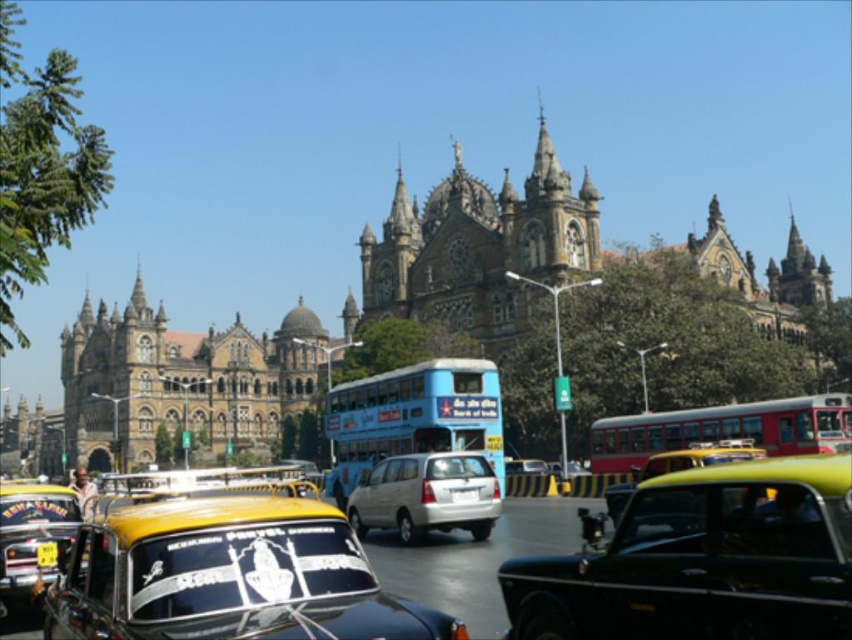
Question: Is yellow matte taxi cab at lower left below white plastic license plate at center?

Choices:
 (A) no
 (B) yes

Answer: (B)

Question: Which of the following is the closest to the observer?

Choices:
 (A) (186, 596)
 (B) (36, 586)

Answer: (A)

Question: Does yellow matte taxi cab at center have a larger size compared to white matte van at center?

Choices:
 (A) yes
 (B) no

Answer: (A)

Question: Estimate the real-world distances between objects in this image. Which object is closer to the yellow matte taxi cab at center?

Choices:
 (A) black glossy taxi at center
 (B) yellow matte taxi cab at lower left
 (C) white matte van at center
 (D) red matte bus at center

Answer: (B)

Question: Which point appears closest to the camera in this image?

Choices:
 (A) (3, 552)
 (B) (494, 467)

Answer: (A)

Question: Can you confirm if black glossy taxi at center is positioned to the left of red matte bus at center?

Choices:
 (A) no
 (B) yes

Answer: (B)